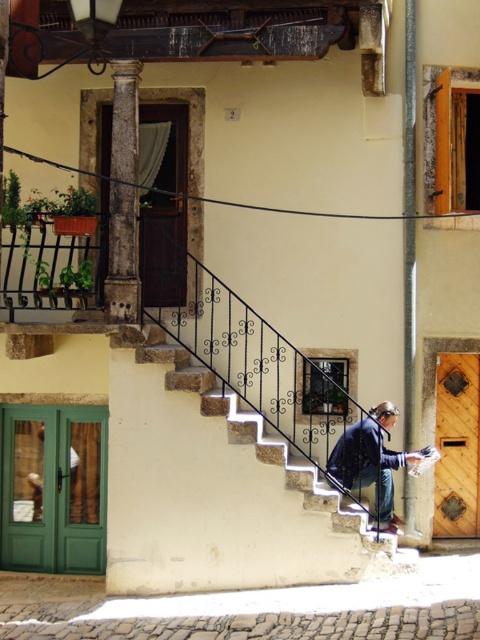
Question: From the image, what is the correct spatial relationship of rustic stone column at left in relation to light brown leather jacket at lower right?

Choices:
 (A) right
 (B) left

Answer: (A)

Question: Which point is closer to the camera?

Choices:
 (A) rustic stone column at left
 (B) blue denim jacket at center

Answer: (A)

Question: Which point is farther to the camera?

Choices:
 (A) (333, 464)
 (B) (45, 275)

Answer: (A)

Question: Considering the real-world distances, which object is farthest from the light brown leather jacket at lower right?

Choices:
 (A) stone textured stairs at center
 (B) rustic stone column at left
 (C) blue denim jacket at center
 (D) black wrought iron at upper left

Answer: (C)

Question: Does black wrought iron at upper left have a greater width compared to blue denim jacket at center?

Choices:
 (A) no
 (B) yes

Answer: (B)

Question: Is blue denim jacket at center to the right of light brown leather jacket at lower right from the viewer's perspective?

Choices:
 (A) no
 (B) yes

Answer: (B)